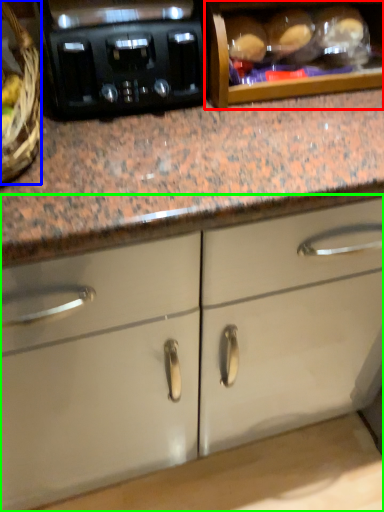
Question: Considering the real-world distances, which object is closest to cabinetry (highlighted by a red box)? basket (highlighted by a blue box) or cabinetry (highlighted by a green box).

Choices:
 (A) basket
 (B) cabinetry

Answer: (A)